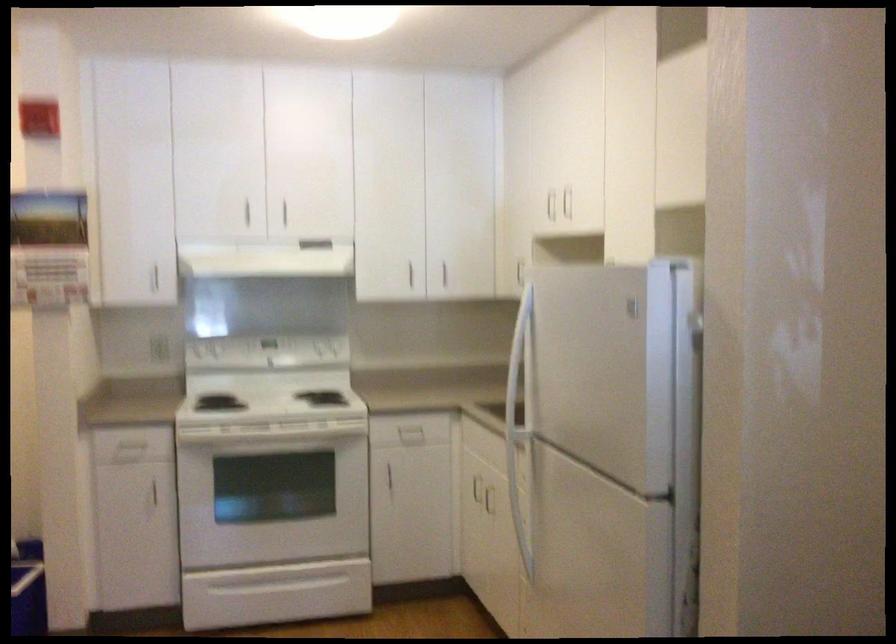
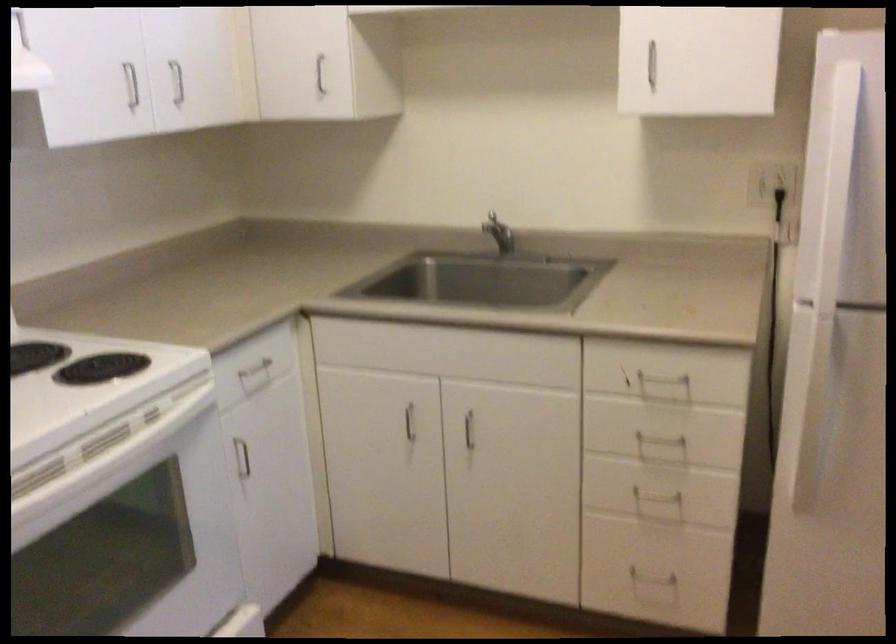
Locate, in the second image, the point that corresponds to pixel 487 495 in the first image.

(469, 430)